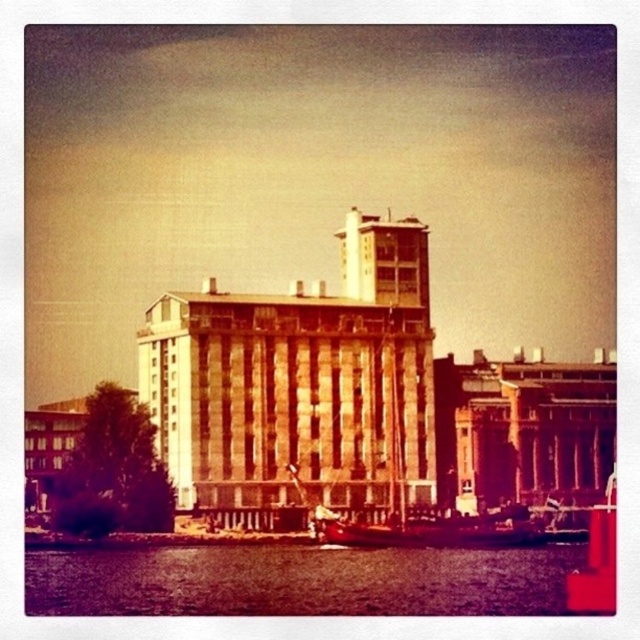
In the scene shown: Is purple water at lower left taller than smooth wooden boat at center?

In fact, purple water at lower left may be shorter than smooth wooden boat at center.

Does purple water at lower left have a larger size compared to smooth wooden boat at center?

No, purple water at lower left is not bigger than smooth wooden boat at center.

This screenshot has width=640, height=640. What do you see at coordinates (298, 580) in the screenshot?
I see `purple water at lower left` at bounding box center [298, 580].

Identify the location of purple water at lower left. (298, 580).